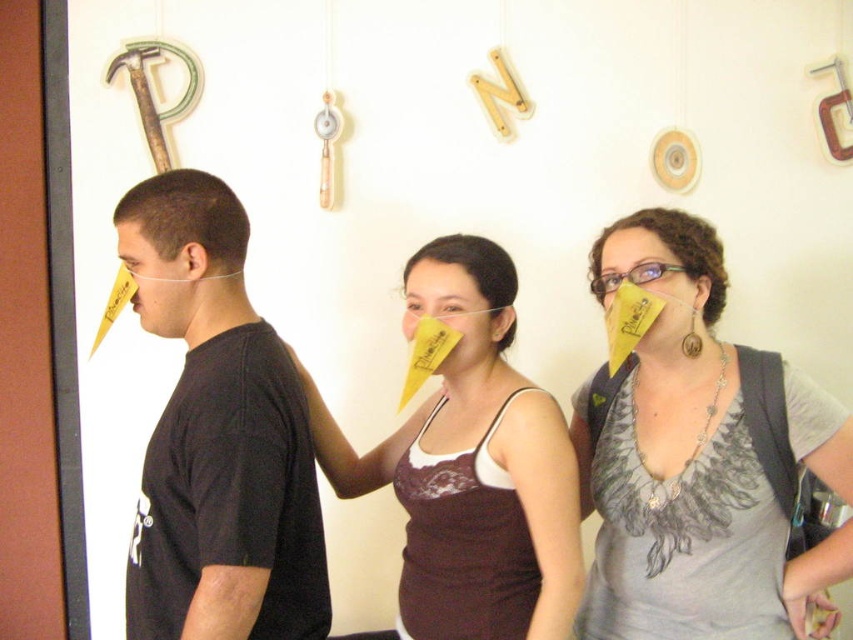
Please describe the position of the yellow paper cone at center in terms of its coordinates within the image frame. The image frame has a coordinate system where the origin is at the bottom left corner, with x increasing to the right and y increasing upward. The coordinates are normalized between 0 and 1. You must use the exact object label from the Objects section in your answer.

The yellow paper cone at center is located at coordinates approximately 0.719 along the x axis and 0.821 along the y axis within the image frame.